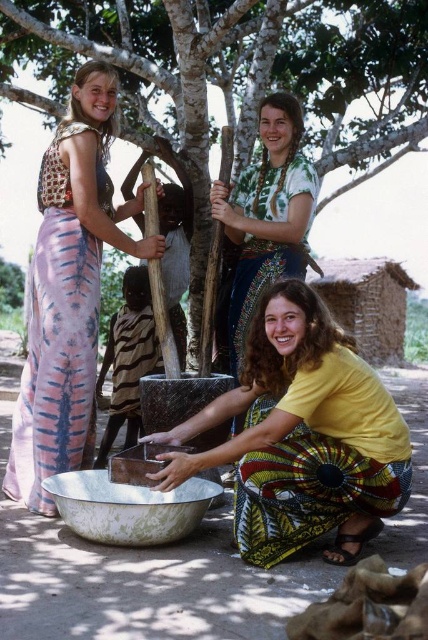
You are standing at the viewer position in the scene. There is a point at coordinates point (94, 157). Can you reach this point without moving your feet?

The point at coordinates point (94, 157) is 13.99 feet away from the viewer. Since this distance is greater than the typical human arm reach of about 2 feet, you cannot reach the point without moving your feet.